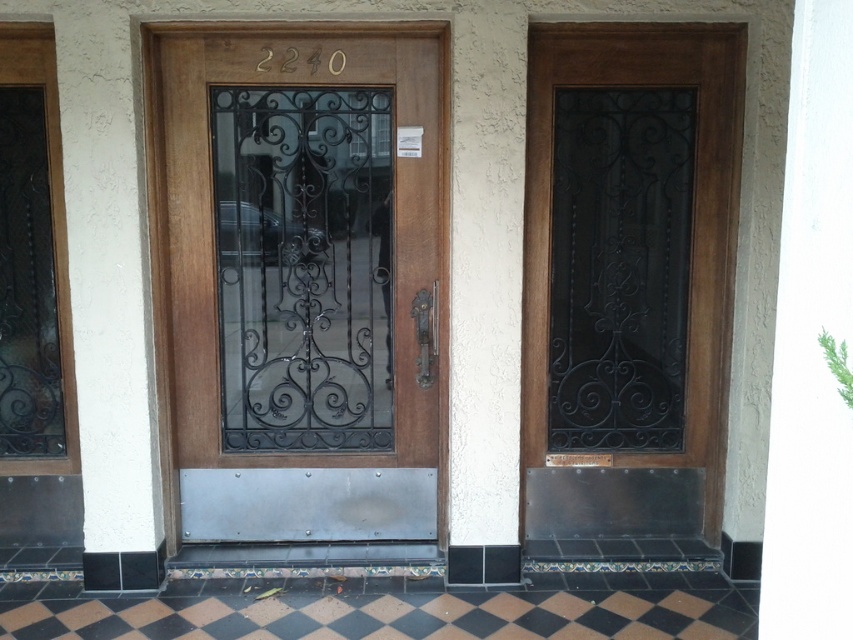
Where is `matte wood door at center`? This screenshot has height=640, width=853. matte wood door at center is located at coordinates (300, 278).

Who is positioned more to the right, matte wood door at center or black wrought iron glass door at center?

Positioned to the right is black wrought iron glass door at center.

What do you see at coordinates (300, 278) in the screenshot? I see `matte wood door at center` at bounding box center [300, 278].

Locate an element on the screen. The width and height of the screenshot is (853, 640). matte wood door at center is located at coordinates (300, 278).